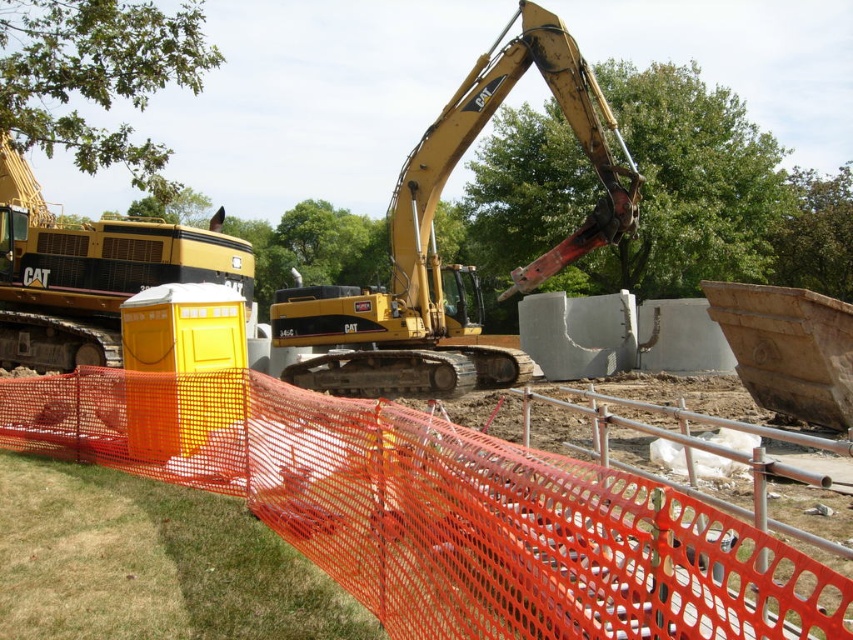
Question: Among these points, which one is farthest from the camera?

Choices:
 (A) (410, 244)
 (B) (572, 540)

Answer: (A)

Question: Does orange mesh fence at center appear on the right side of yellow metallic excavator at center?

Choices:
 (A) no
 (B) yes

Answer: (A)

Question: Can you confirm if orange mesh fence at center is bigger than yellow metallic excavator at center?

Choices:
 (A) no
 (B) yes

Answer: (A)

Question: Where is orange mesh fence at center located in relation to yellow metallic excavator at center in the image?

Choices:
 (A) above
 (B) below

Answer: (B)

Question: Among these objects, which one is farthest from the camera?

Choices:
 (A) yellow metallic excavator at center
 (B) orange mesh fence at center

Answer: (A)

Question: Which object appears closest to the camera in this image?

Choices:
 (A) orange mesh fence at center
 (B) yellow metallic excavator at center

Answer: (A)